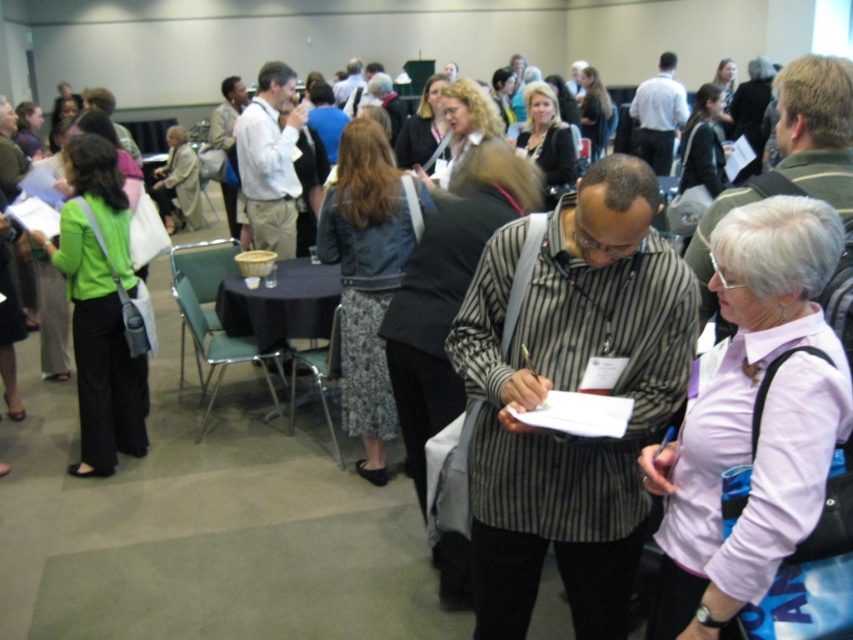
You are attending a conference and notice two people at center stage. The striped shirt at center and the white shirt at center are standing next to each other. Which one is shorter?

The striped shirt at center is shorter than the white shirt at center.

You are organizing a photo shoot in this conference hall and need to position two models exactly 10 feet apart. You have two people dressed as the striped shirt at center and the light beige cotton shirt at center. Can you use their current positions to achieve the desired distance?

The striped shirt at center and light beige cotton shirt at center are currently 10.21 feet apart from each other, which is slightly more than the required 10 feet. You can adjust their positions by moving them closer by 0.21 feet to meet the exact distance needed for the photo shoot.